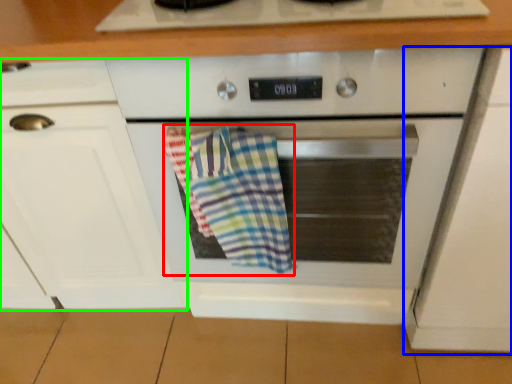
Question: Which object is positioned farthest from beach towel (highlighted by a red box)? Select from cabinetry (highlighted by a blue box) and cabinetry (highlighted by a green box).

Choices:
 (A) cabinetry
 (B) cabinetry

Answer: (A)